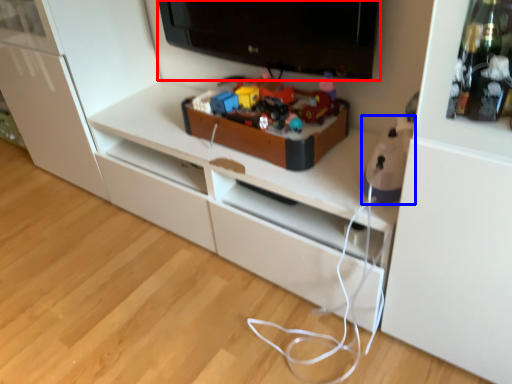
Question: Which object appears closest to the camera in this image, television (highlighted by a red box) or toy (highlighted by a blue box)?

Choices:
 (A) television
 (B) toy

Answer: (B)